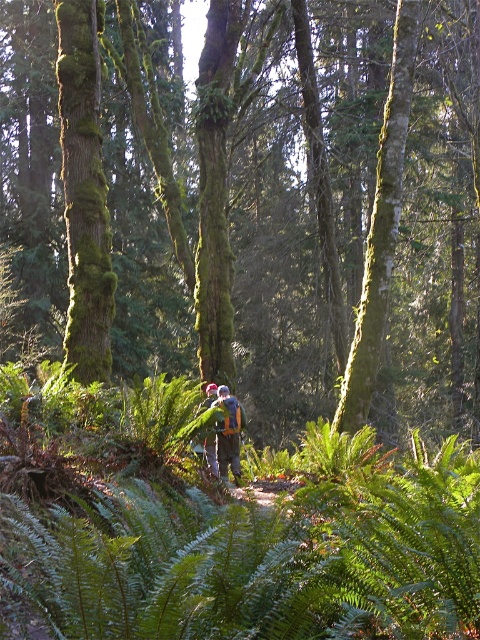
You are a hiker who wants to take a photo of the green mossy tree at center and the camouflage fabric backpack at center. Which object should you focus on first if you want to capture both in the same frame without moving your camera?

The green mossy tree at center is positioned on the left side of camouflage fabric backpack at center, so you should focus on the green mossy tree at center first to ensure both are in the frame.

You are a hiker who wants to take a photo of the green mossy tree at center and the camouflage fabric backpack at center. Since you want both objects to be clearly visible in the photo, which one should you focus on first?

You should focus on the green mossy tree at center first because it is in front of the camouflage fabric backpack at center, so focusing on the tree will ensure it is sharp while the backpack may still be in focus depending on the depth of field.